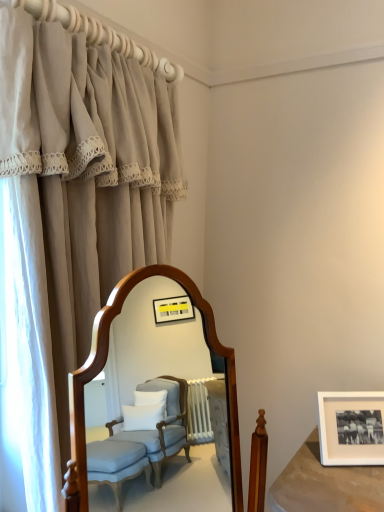
Question: Is white matte picture frame at lower right wider than beige fabric curtain at left?

Choices:
 (A) no
 (B) yes

Answer: (A)

Question: Is white matte picture frame at lower right with beige fabric curtain at left?

Choices:
 (A) no
 (B) yes

Answer: (A)

Question: From a real-world perspective, is white matte picture frame at lower right located higher than beige fabric curtain at left?

Choices:
 (A) yes
 (B) no

Answer: (B)

Question: Is white matte picture frame at lower right to the left of beige fabric curtain at left from the viewer's perspective?

Choices:
 (A) yes
 (B) no

Answer: (B)

Question: Considering the relative sizes of white matte picture frame at lower right and beige fabric curtain at left in the image provided, is white matte picture frame at lower right taller than beige fabric curtain at left?

Choices:
 (A) no
 (B) yes

Answer: (A)

Question: From the image's perspective, would you say white matte picture frame at lower right is positioned over beige fabric curtain at left?

Choices:
 (A) no
 (B) yes

Answer: (A)

Question: From a real-world perspective, is beige fabric curtain at left over white matte picture frame at lower right?

Choices:
 (A) yes
 (B) no

Answer: (A)

Question: From a real-world perspective, does beige fabric curtain at left sit lower than white matte picture frame at lower right?

Choices:
 (A) yes
 (B) no

Answer: (B)

Question: From the image's perspective, does beige fabric curtain at left appear lower than white matte picture frame at lower right?

Choices:
 (A) yes
 (B) no

Answer: (B)

Question: Is beige fabric curtain at left closer to camera compared to white matte picture frame at lower right?

Choices:
 (A) yes
 (B) no

Answer: (A)

Question: Is beige fabric curtain at left far from white matte picture frame at lower right?

Choices:
 (A) no
 (B) yes

Answer: (B)

Question: Does beige fabric curtain at left have a greater height compared to white matte picture frame at lower right?

Choices:
 (A) yes
 (B) no

Answer: (A)

Question: Is white matte picture frame at lower right inside the boundaries of beige fabric curtain at left, or outside?

Choices:
 (A) inside
 (B) outside

Answer: (B)